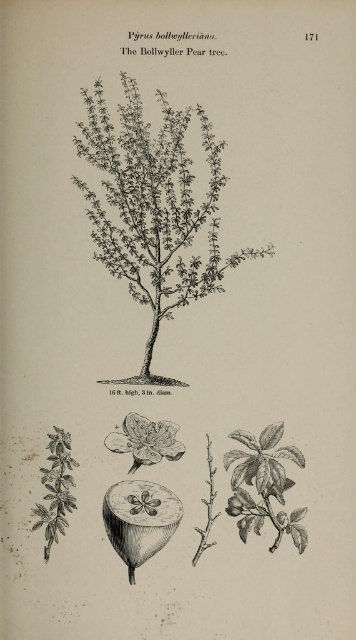
Is black line drawing tree at center taller than white paper-like at center?

Correct, black line drawing tree at center is much taller as white paper-like at center.

You are a GUI agent. You are given a task and a screenshot of the screen. Output one action in this format:
    pyautogui.click(x=<x>, y=<y>)
    Task: Click on the black line drawing tree at center
    Image resolution: width=356 pixels, height=640 pixels.
    Given the screenshot: What is the action you would take?
    pyautogui.click(x=153, y=208)